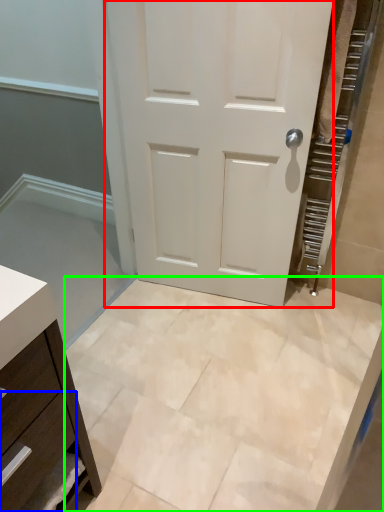
Question: Which object is positioned farthest from door (highlighted by a red box)? Select from drawer (highlighted by a blue box) and ceramic tile (highlighted by a green box).

Choices:
 (A) drawer
 (B) ceramic tile

Answer: (A)